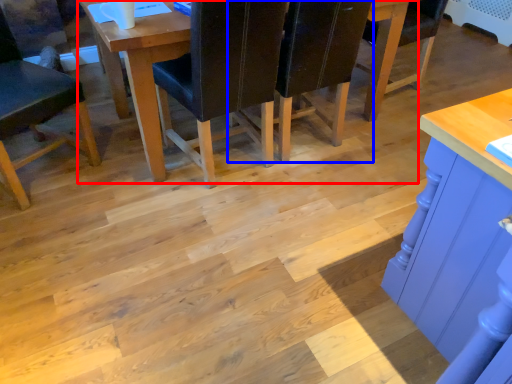
Question: Which object appears farthest to the camera in this image, table (highlighted by a red box) or chair (highlighted by a blue box)?

Choices:
 (A) table
 (B) chair

Answer: (B)